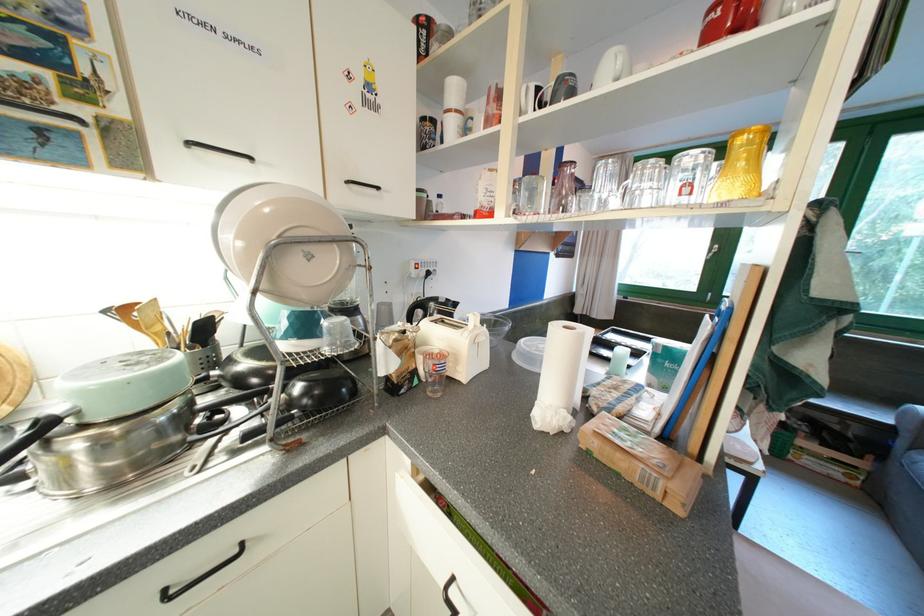
Find where to lift the white mug handle. Please return your answer as a coordinate pair (x, y).

(524, 100)